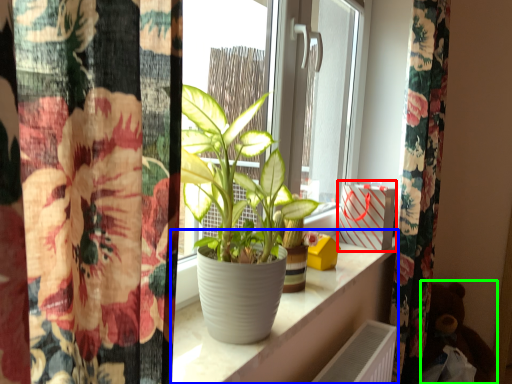
Question: Which object is the farthest from window box (highlighted by a red box)? Choose among these: window sill (highlighted by a blue box) or toy (highlighted by a green box).

Choices:
 (A) window sill
 (B) toy

Answer: (B)